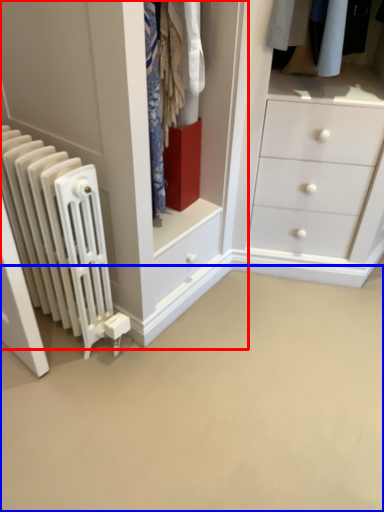
Question: Which object is further to the camera taking this photo, closet (highlighted by a red box) or plain (highlighted by a blue box)?

Choices:
 (A) closet
 (B) plain

Answer: (A)